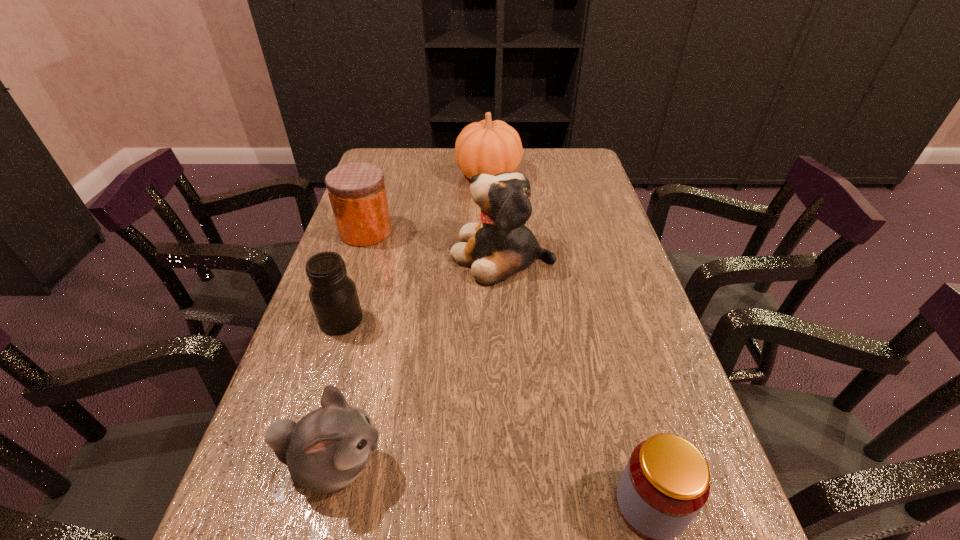
Where is `vacant space that's between the hamster and the farthest jar`? vacant space that's between the hamster and the farthest jar is located at coordinates (349, 348).

In order to click on vacant area that lies between the second farthest jar and the puppy in this screenshot , I will do `click(421, 287)`.

You are a GUI agent. You are given a task and a screenshot of the screen. Output one action in this format:
    pyautogui.click(x=<x>, y=<y>)
    Task: Click on the free point between the puppy and the third nearest object
    The height and width of the screenshot is (540, 960).
    Given the screenshot: What is the action you would take?
    pyautogui.click(x=421, y=287)

The height and width of the screenshot is (540, 960). Identify the location of the fifth closest object to the farthest jar. (666, 482).

Find the location of a particular element. The image size is (960, 540). object that stands as the second closest to the nearest jar is located at coordinates (500, 245).

Point out which jar is positioned as the nearest to the shortest jar. Please provide its 2D coordinates. Your answer should be formatted as a tuple, i.e. [(x, y)], where the tuple contains the x and y coordinates of a point satisfying the conditions above.

[(333, 295)]

Select which jar is the second closest to the farthest jar. Please provide its 2D coordinates. Your answer should be formatted as a tuple, i.e. [(x, y)], where the tuple contains the x and y coordinates of a point satisfying the conditions above.

[(666, 482)]